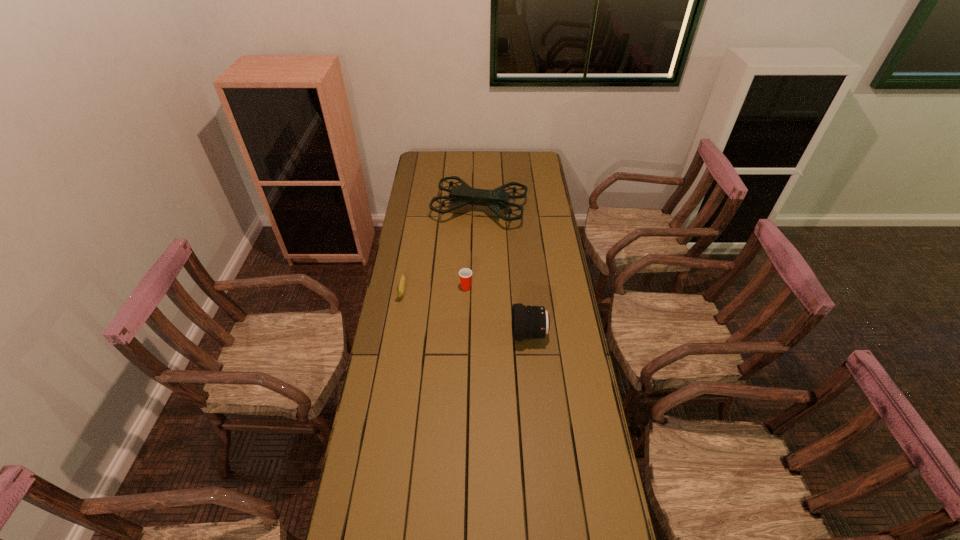
Point out which object is positioned as the nearest to the drone. Please provide its 2D coordinates. Your answer should be formatted as a tuple, i.e. [(x, y)], where the tuple contains the x and y coordinates of a point satisfying the conditions above.

[(400, 291)]